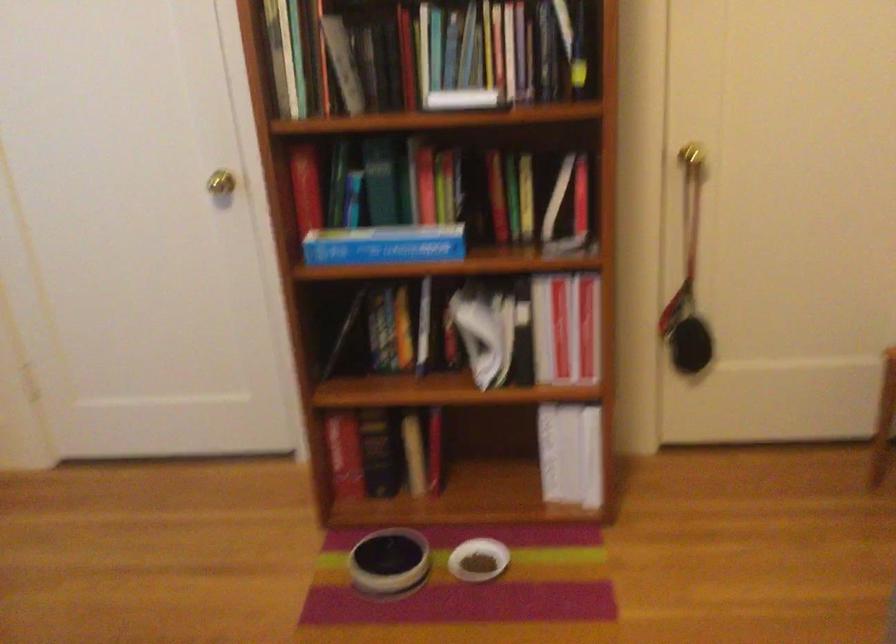
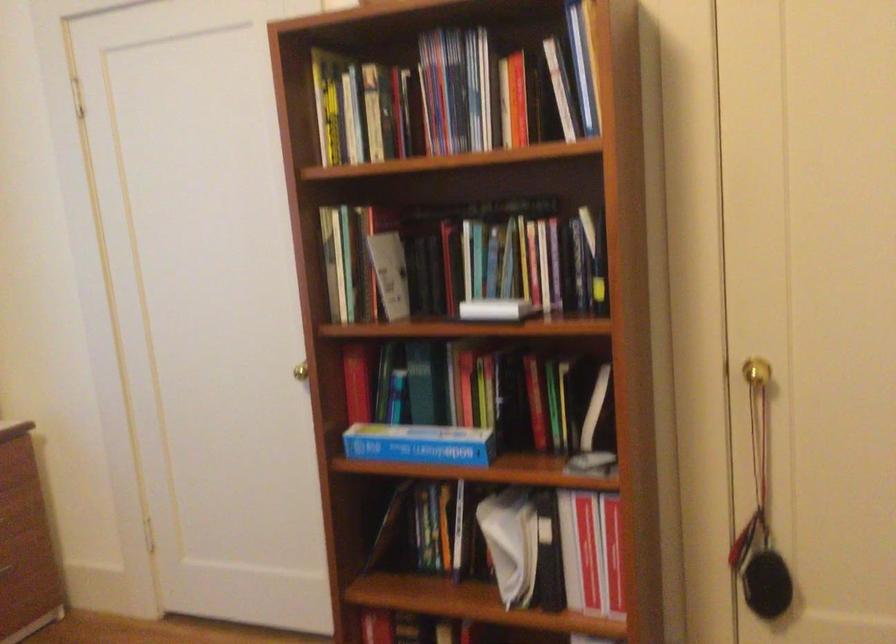
Question: The camera is either moving clockwise (left) or counter-clockwise (right) around the object. The first image is from the beginning of the video and the second image is from the end. Is the camera moving left or right when shooting the video?

Choices:
 (A) Left
 (B) Right

Answer: (B)